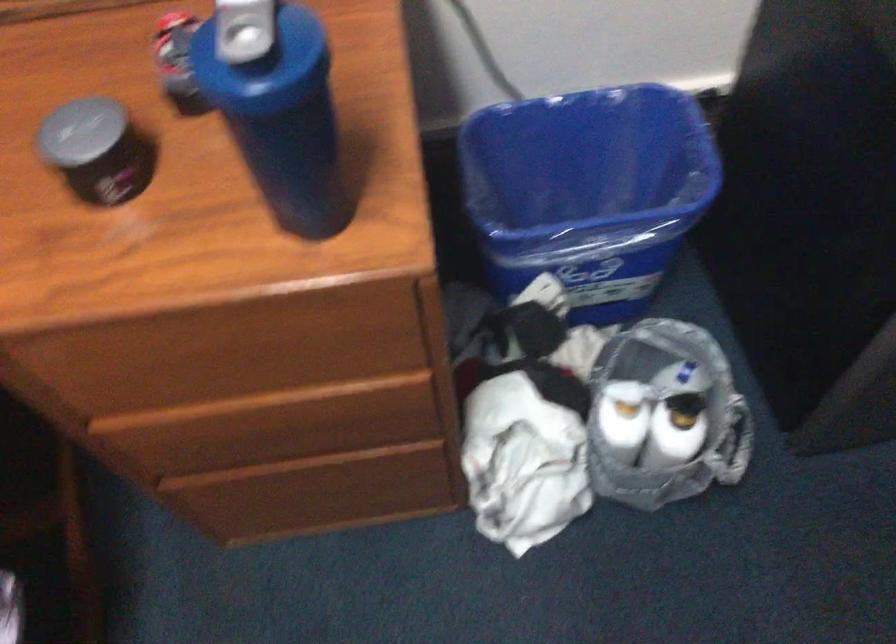
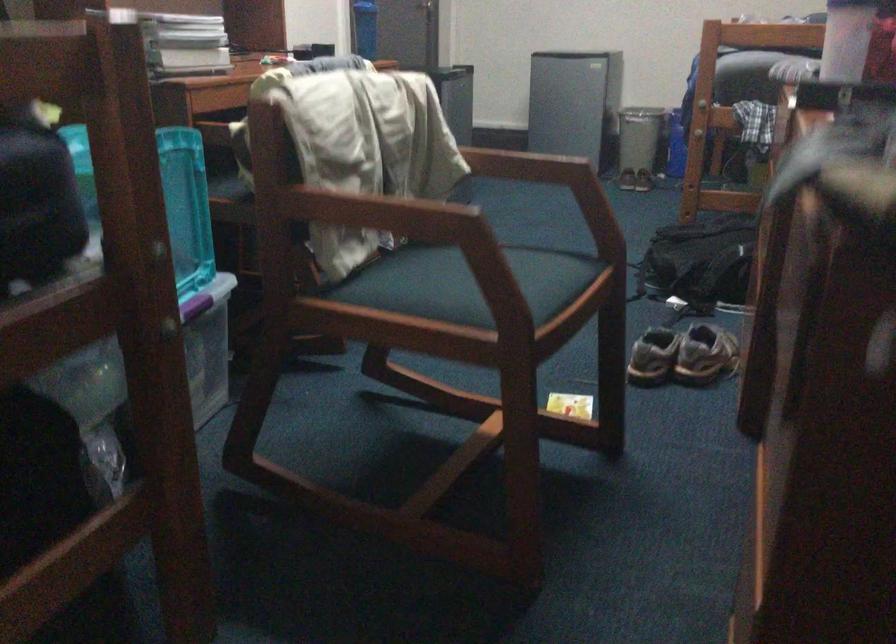
Question: I am providing you with two images of the same scene from different viewpoints. Please identify which objects are invisible in image2.

Choices:
 (A) blue water bottle
 (B) wooden chair armrest
 (C) Iron Man figurine
 (D) white bottle

Answer: (D)